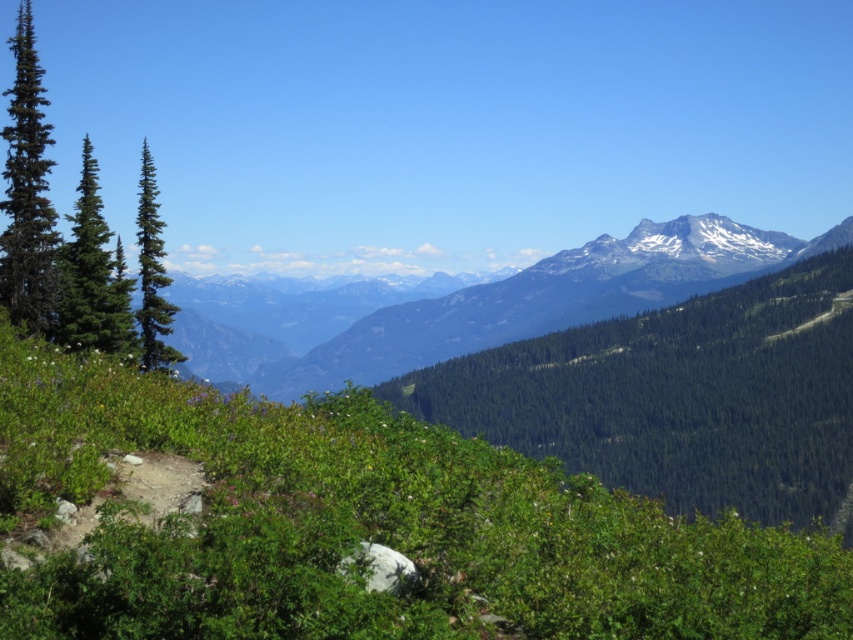
Does green forested mountain range at center have a smaller size compared to green matte evergreen tree at left?

No, green forested mountain range at center is not smaller than green matte evergreen tree at left.

Does point (740, 269) come closer to viewer compared to point (74, 257)?

No, (740, 269) is behind (74, 257).

You are a GUI agent. You are given a task and a screenshot of the screen. Output one action in this format:
    pyautogui.click(x=<x>, y=<y>)
    Task: Click on the green forested mountain range at center
    
    Given the screenshot: What is the action you would take?
    pyautogui.click(x=517, y=304)

In the scene shown: Is green forested mountain range at center bigger than green matte tree at left?

Correct, green forested mountain range at center is larger in size than green matte tree at left.

Between green forested mountain range at center and green matte tree at left, which one appears on the right side from the viewer's perspective?

green forested mountain range at center

Is point (641, 257) farther from viewer compared to point (146, 307)?

Yes.

At what (x,y) coordinates should I click in order to perform the action: click on green forested mountain range at center. Please return your answer as a coordinate pair (x, y). The image size is (853, 640). Looking at the image, I should click on (517, 304).

Which is above, green leafy tree at center or green matte evergreen tree at left?

Positioned higher is green matte evergreen tree at left.

Can you confirm if green leafy tree at center is thinner than green matte evergreen tree at left?

In fact, green leafy tree at center might be wider than green matte evergreen tree at left.

In order to click on green leafy tree at center in this screenshot , I will do `click(680, 397)`.

At what (x,y) coordinates should I click in order to perform the action: click on green leafy tree at center. Please return your answer as a coordinate pair (x, y). Image resolution: width=853 pixels, height=640 pixels. Looking at the image, I should click on (680, 397).